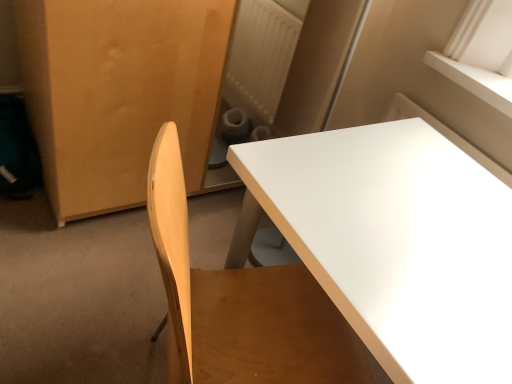
Locate an element on the screen. Image resolution: width=512 pixels, height=384 pixels. matte wood armoire at left is located at coordinates [x=118, y=92].

Measure the distance between matte wood armoire at left and camera.

The distance of matte wood armoire at left from camera is 99.35 centimeters.

The width and height of the screenshot is (512, 384). What do you see at coordinates (118, 92) in the screenshot?
I see `matte wood armoire at left` at bounding box center [118, 92].

Locate an element on the screen. The height and width of the screenshot is (384, 512). white glossy table at center is located at coordinates (394, 242).

The width and height of the screenshot is (512, 384). Describe the element at coordinates (394, 242) in the screenshot. I see `white glossy table at center` at that location.

You are a GUI agent. You are given a task and a screenshot of the screen. Output one action in this format:
    pyautogui.click(x=<x>, y=<y>)
    Task: Click on the matte wood armoire at left
    The width and height of the screenshot is (512, 384).
    Given the screenshot: What is the action you would take?
    pyautogui.click(x=118, y=92)

Does matte wood armoire at left appear on the right side of white glossy table at center?

No.

Which object is further away from the camera taking this photo, matte wood armoire at left or white glossy table at center?

matte wood armoire at left is further from the camera.

Does point (200, 53) lie behind point (418, 183)?

Yes, it is behind point (418, 183).

From the image's perspective, is matte wood armoire at left on white glossy table at center?

Yes, from the image's perspective, matte wood armoire at left is over white glossy table at center.

From a real-world perspective, is matte wood armoire at left positioned under white glossy table at center based on gravity?

Actually, matte wood armoire at left is physically above white glossy table at center in the real world.

Does matte wood armoire at left have a greater width compared to white glossy table at center?

Correct, the width of matte wood armoire at left exceeds that of white glossy table at center.

Can you confirm if matte wood armoire at left is taller than white glossy table at center?

Yes, matte wood armoire at left is taller than white glossy table at center.

Can you confirm if matte wood armoire at left is bigger than white glossy table at center?

Yes, matte wood armoire at left is bigger than white glossy table at center.

Is matte wood armoire at left outside of white glossy table at center?

Yes, matte wood armoire at left is outside of white glossy table at center.

Is matte wood armoire at left not close to white glossy table at center?

No, matte wood armoire at left is in close proximity to white glossy table at center.

Could you tell me if matte wood armoire at left is turned towards white glossy table at center?

Yes, matte wood armoire at left faces towards white glossy table at center.

What's the angular difference between matte wood armoire at left and white glossy table at center's facing directions?

The angle between the facing direction of matte wood armoire at left and the facing direction of white glossy table at center is 90.6 degrees.

Identify the location of armoire located behind the white glossy table at center. (118, 92).

In the image, is white glossy table at center on the left side or the right side of matte wood armoire at left?

white glossy table at center is positioned on matte wood armoire at left's right side.

Does white glossy table at center come in front of matte wood armoire at left?

Yes.

Considering the points (473, 218) and (198, 125), which point is in front, point (473, 218) or point (198, 125)?

The point (473, 218) is closer.

From the image's perspective, would you say white glossy table at center is shown under matte wood armoire at left?

Yes.

From a real-world perspective, is white glossy table at center beneath matte wood armoire at left?

Yes, from a real-world perspective, white glossy table at center is below matte wood armoire at left.

Which object is thinner, white glossy table at center or matte wood armoire at left?

Thinner between the two is white glossy table at center.

Does white glossy table at center have a lesser height compared to matte wood armoire at left?

Yes.

Considering the sizes of objects white glossy table at center and matte wood armoire at left in the image provided, who is smaller, white glossy table at center or matte wood armoire at left?

Smaller between the two is white glossy table at center.

Would you say white glossy table at center is outside matte wood armoire at left?

Yes, white glossy table at center is not within matte wood armoire at left.

Can you see white glossy table at center touching matte wood armoire at left?

No, white glossy table at center is not making contact with matte wood armoire at left.

Could you tell me if white glossy table at center is turned towards matte wood armoire at left?

No, white glossy table at center is not facing towards matte wood armoire at left.

How many degrees apart are the facing directions of white glossy table at center and matte wood armoire at left?

They differ by 90.6 degrees in their facing directions.

The height and width of the screenshot is (384, 512). I want to click on table that appears below the matte wood armoire at left (from a real-world perspective), so click(394, 242).

At what (x,y) coordinates should I click in order to perform the action: click on armoire on the left of white glossy table at center. Please return your answer as a coordinate pair (x, y). The image size is (512, 384). Looking at the image, I should click on (118, 92).

Where is `table in front of the matte wood armoire at left`? The image size is (512, 384). table in front of the matte wood armoire at left is located at coordinates (394, 242).